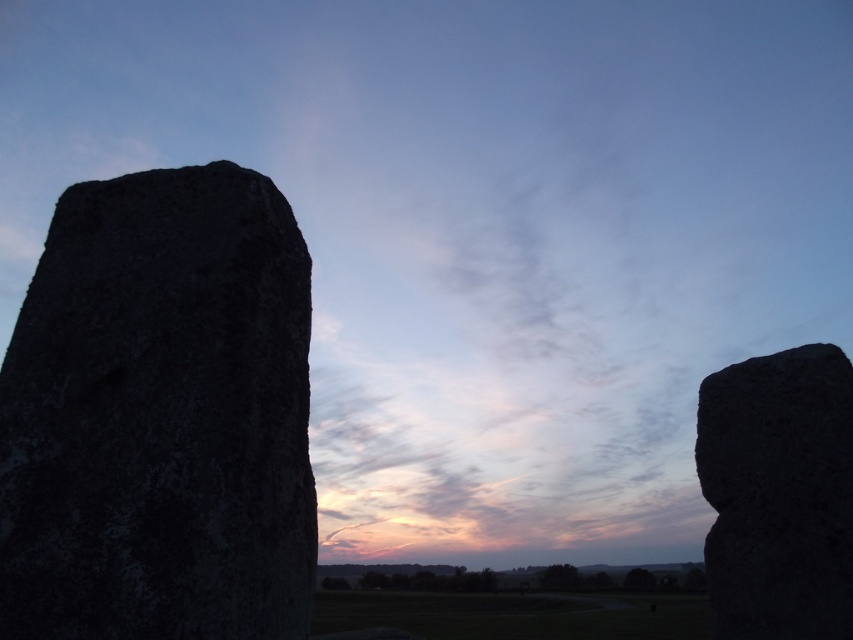
Is granite rock at left positioned behind granite boulder at right?

No, it is not.

Between point (173, 256) and point (836, 369), which one is positioned behind?

The point (836, 369) is more distant.

The width and height of the screenshot is (853, 640). I want to click on granite rock at left, so click(160, 417).

Find the location of a particular element. This screenshot has height=640, width=853. granite rock at left is located at coordinates 160,417.